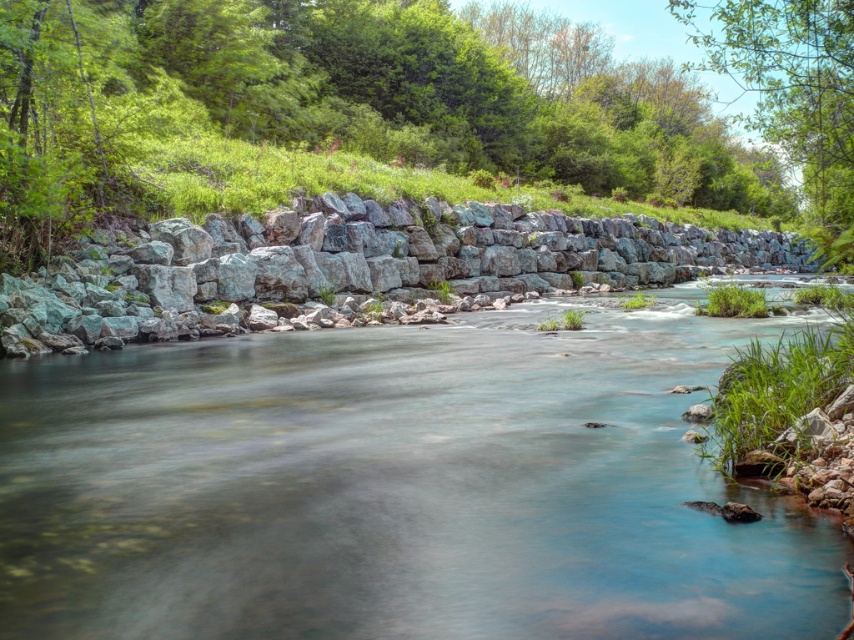
This screenshot has width=854, height=640. I want to click on gray rock wall at center, so click(351, 266).

Which is in front, point (173, 227) or point (733, 54)?

Point (733, 54) is in front.

You are a GUI agent. You are given a task and a screenshot of the screen. Output one action in this format:
    pyautogui.click(x=<x>, y=<y>)
    Task: Click on the gray rock wall at center
    The image size is (854, 640).
    Given the screenshot: What is the action you would take?
    pyautogui.click(x=351, y=266)

Is point (215, 561) farther from camera compared to point (647, 150)?

That is False.

Which of these two, gray stone river at center or green leafy tree at upper center, stands taller?

green leafy tree at upper center is taller.

Find the location of a particular element. gray stone river at center is located at coordinates (398, 486).

Who is more forward, [364,16] or [170,275]?

Positioned in front is point [170,275].

Does green leafy tree at upper center have a lesser height compared to gray rock wall at center?

No, green leafy tree at upper center is not shorter than gray rock wall at center.

Does point (60, 189) come farther from viewer compared to point (559, 220)?

No, it is not.

What are the coordinates of `green leafy tree at upper center` in the screenshot? It's located at (344, 104).